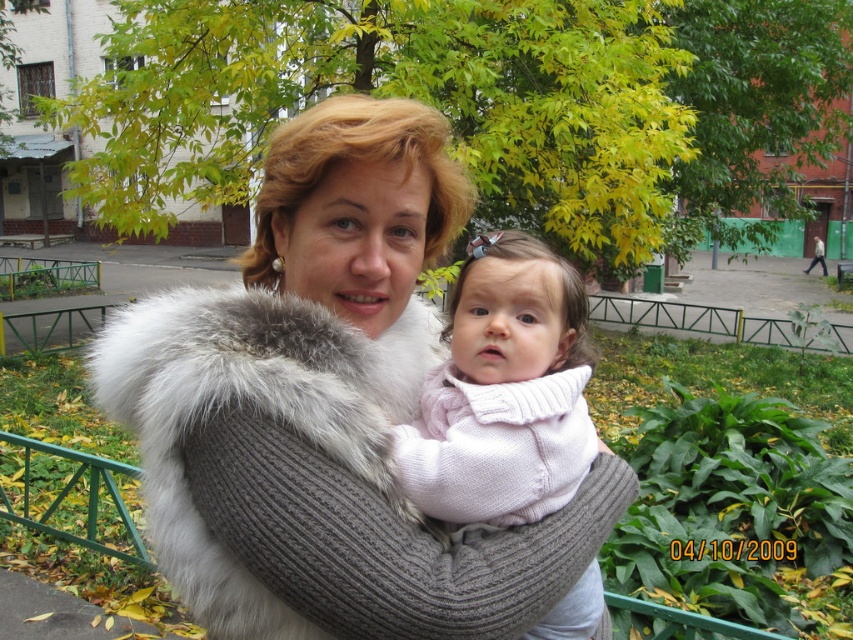
Question: Which point appears closest to the camera in this image?

Choices:
 (A) (370, 419)
 (B) (432, 397)

Answer: (A)

Question: Can you confirm if gray furry scarf at center is thinner than pink knitted sweater at center?

Choices:
 (A) no
 (B) yes

Answer: (A)

Question: Does gray furry scarf at center have a larger size compared to pink knitted sweater at center?

Choices:
 (A) no
 (B) yes

Answer: (B)

Question: Which of the following is the closest to the observer?

Choices:
 (A) pink knitted sweater at center
 (B) gray furry scarf at center

Answer: (B)

Question: Can you confirm if gray furry scarf at center is positioned to the left of pink knitted sweater at center?

Choices:
 (A) yes
 (B) no

Answer: (A)